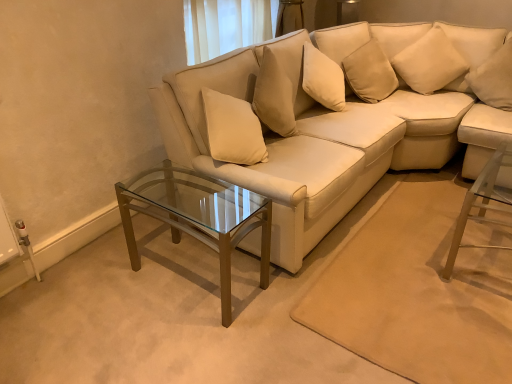
Question: From a real-world perspective, is matte white couch at center located higher than clear glass coffee table at center?

Choices:
 (A) yes
 (B) no

Answer: (A)

Question: Is matte white couch at center to the left of clear glass coffee table at center from the viewer's perspective?

Choices:
 (A) yes
 (B) no

Answer: (B)

Question: Could you tell me if matte white couch at center is facing clear glass coffee table at center?

Choices:
 (A) no
 (B) yes

Answer: (A)

Question: Is matte white couch at center bigger than clear glass coffee table at center?

Choices:
 (A) yes
 (B) no

Answer: (A)

Question: Considering the relative sizes of matte white couch at center and clear glass coffee table at center in the image provided, is matte white couch at center shorter than clear glass coffee table at center?

Choices:
 (A) yes
 (B) no

Answer: (B)

Question: Is matte white couch at center outside clear glass coffee table at center?

Choices:
 (A) yes
 (B) no

Answer: (A)

Question: From the image's perspective, would you say clear glass coffee table at center is shown under matte white couch at center?

Choices:
 (A) yes
 (B) no

Answer: (A)

Question: Is clear glass coffee table at center next to matte white couch at center?

Choices:
 (A) yes
 (B) no

Answer: (B)

Question: Would you say clear glass coffee table at center is outside matte white couch at center?

Choices:
 (A) yes
 (B) no

Answer: (A)

Question: Is clear glass coffee table at center closer to the viewer compared to matte white couch at center?

Choices:
 (A) yes
 (B) no

Answer: (A)

Question: Is clear glass coffee table at center smaller than matte white couch at center?

Choices:
 (A) yes
 (B) no

Answer: (A)

Question: Considering the relative sizes of clear glass coffee table at center and matte white couch at center in the image provided, is clear glass coffee table at center wider than matte white couch at center?

Choices:
 (A) yes
 (B) no

Answer: (B)

Question: From the image's perspective, does white soft pillow at upper right, the first pillow when ordered from right to left, appear lower than soft beige pillow at upper right, the 1th pillow when ordered from left to right?

Choices:
 (A) no
 (B) yes

Answer: (B)